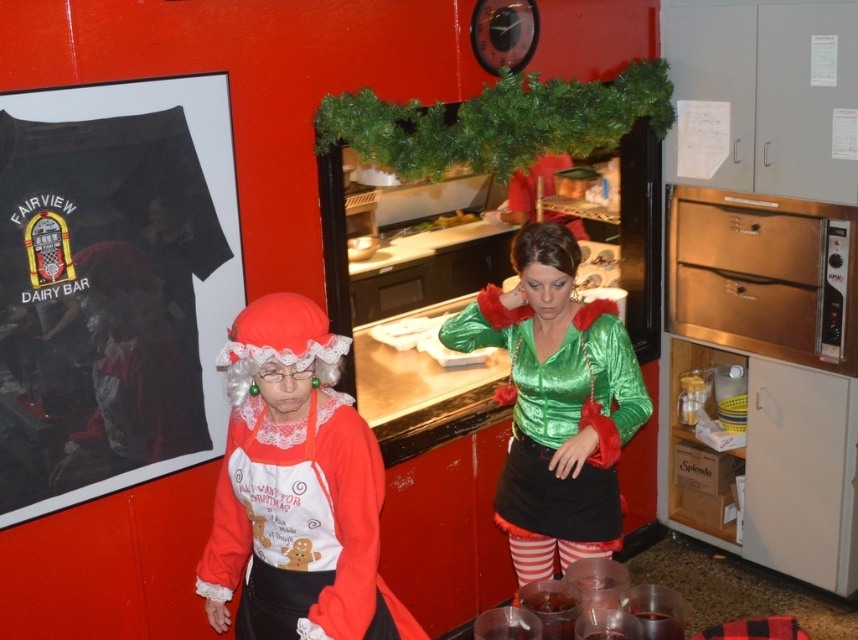
Question: Among these objects, which one is nearest to the camera?

Choices:
 (A) matte white apron at center
 (B) translucent glass cup at lower center

Answer: (A)

Question: Is matte white apron at center wider than green shiny blouse at center?

Choices:
 (A) no
 (B) yes

Answer: (A)

Question: Which point appears closest to the camera in this image?

Choices:
 (A) (512, 529)
 (B) (288, 353)

Answer: (B)

Question: Based on their relative distances, which object is nearer to the translucent glass cup at lower center?

Choices:
 (A) matte white apron at center
 (B) green shiny blouse at center

Answer: (B)

Question: Does matte white apron at center appear over translucent glass cup at lower center?

Choices:
 (A) yes
 (B) no

Answer: (A)

Question: Is green shiny blouse at center wider than translucent glass cup at lower center?

Choices:
 (A) yes
 (B) no

Answer: (A)